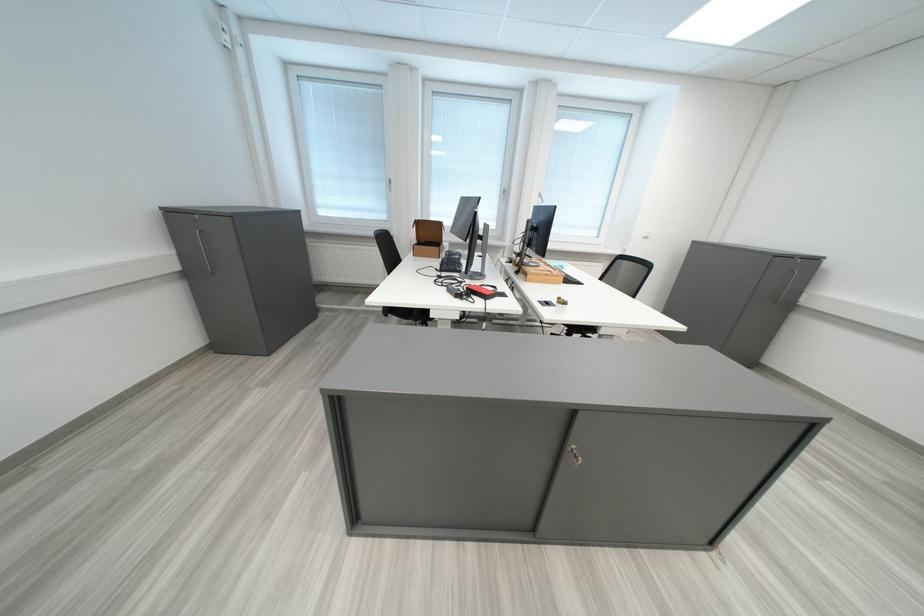
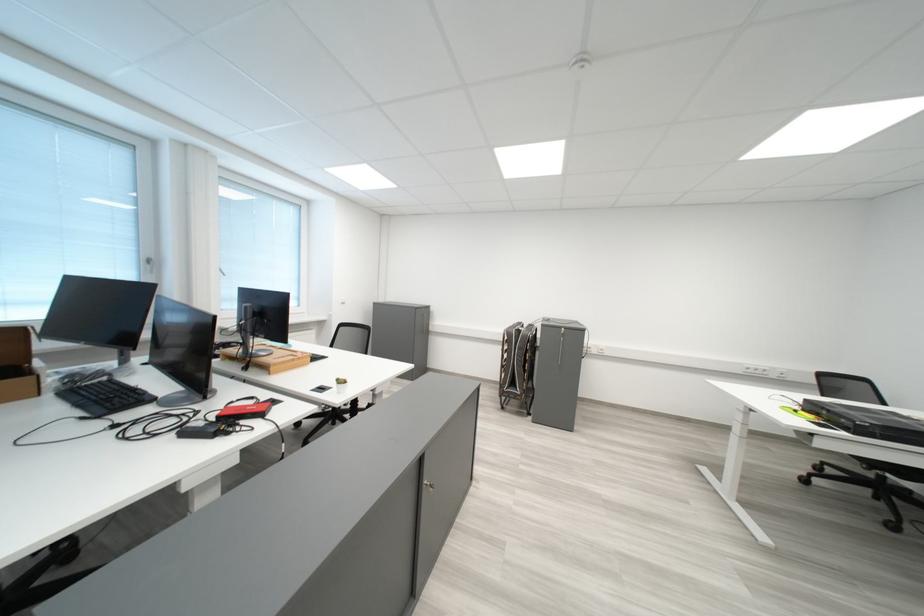
The point at (567, 304) is marked in the first image. Where is the corresponding point in the second image?

(345, 386)